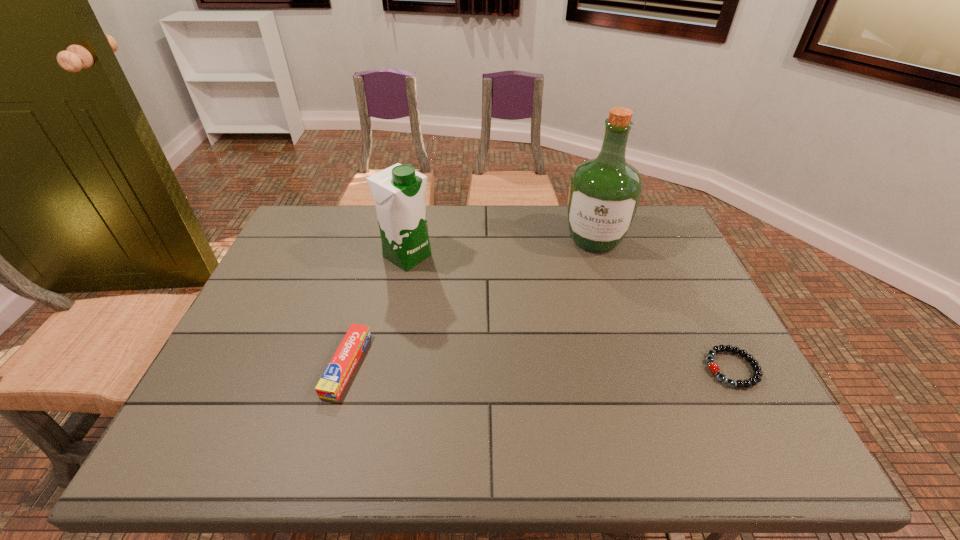
The image size is (960, 540). In order to click on the third tallest object in this screenshot , I will do `click(333, 381)`.

Where is `the shortest object`? the shortest object is located at coordinates (713, 367).

At what (x,y) coordinates should I click in order to perform the action: click on bracelet. Please return your answer as a coordinate pair (x, y). The image size is (960, 540). Looking at the image, I should click on (713, 367).

The image size is (960, 540). Find the location of `the second tallest object`. the second tallest object is located at coordinates (398, 191).

What are the coordinates of `the tallest object` in the screenshot? It's located at pyautogui.click(x=604, y=193).

The height and width of the screenshot is (540, 960). I want to click on the second object from right to left, so click(x=604, y=193).

You are a GUI agent. You are given a task and a screenshot of the screen. Output one action in this format:
    pyautogui.click(x=<x>, y=<y>)
    Task: Click on the free spot located on the back of the third tallest object
    This screenshot has width=960, height=540.
    Given the screenshot: What is the action you would take?
    (363, 305)

The width and height of the screenshot is (960, 540). Identify the location of vacant region located on the left of the shortest object. (536, 368).

Identify the location of free space located 0.320m on the front-facing side of the third shortest object. This screenshot has width=960, height=540. [x=511, y=320].

At what (x,y) coordinates should I click in order to perform the action: click on vacant space located on the front-facing side of the third shortest object. Please return your answer as a coordinate pair (x, y). The width and height of the screenshot is (960, 540). Looking at the image, I should click on (530, 332).